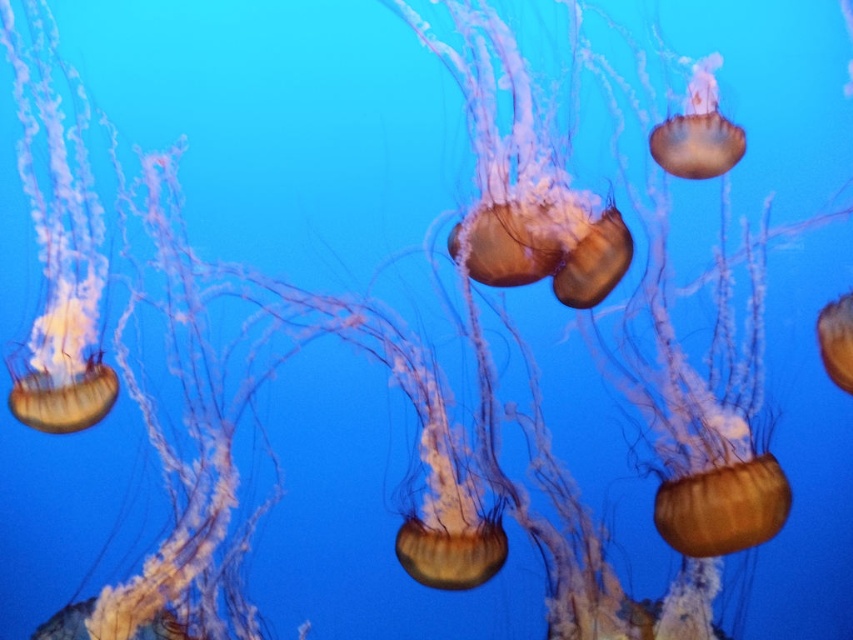
Question: Does translucent golden jellyfish at upper right appear on the left side of translucent golden jellyfish at right?

Choices:
 (A) no
 (B) yes

Answer: (B)

Question: Which point is closer to the camera?

Choices:
 (A) translucent golden jellyfish at upper right
 (B) translucent gelatinous at left
 (C) translucent golden jellyfish at right

Answer: (C)

Question: Can you confirm if translucent gelatinous at left is positioned below translucent golden jellyfish at right?

Choices:
 (A) no
 (B) yes

Answer: (A)

Question: Is translucent gelatinous at left above translucent golden jellyfish at upper right?

Choices:
 (A) yes
 (B) no

Answer: (B)

Question: Which point appears farthest from the camera in this image?

Choices:
 (A) pos(833,305)
 (B) pos(45,230)
 (C) pos(703,93)

Answer: (C)

Question: Which of the following is the farthest from the observer?

Choices:
 (A) translucent golden jellyfish at upper right
 (B) translucent gelatinous at left
 (C) translucent golden jellyfish at right

Answer: (A)